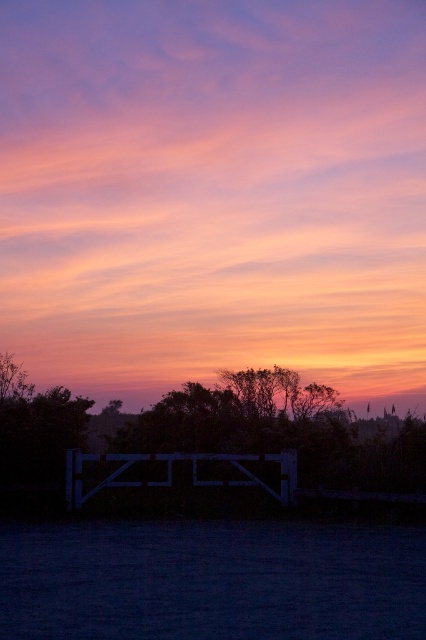
Is green leafy tree at center in front of black matte fence at center?

That is True.

This screenshot has height=640, width=426. I want to click on green leafy tree at center, so click(210, 442).

What are the coordinates of `green leafy tree at center` in the screenshot? It's located at coord(210,442).